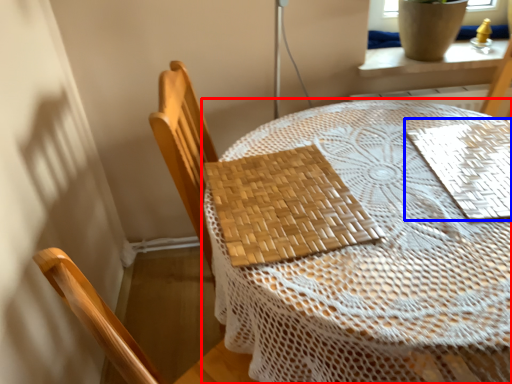
Question: Among these objects, which one is nearest to the camera, table (highlighted by a red box) or mat (highlighted by a blue box)?

Choices:
 (A) table
 (B) mat

Answer: (A)